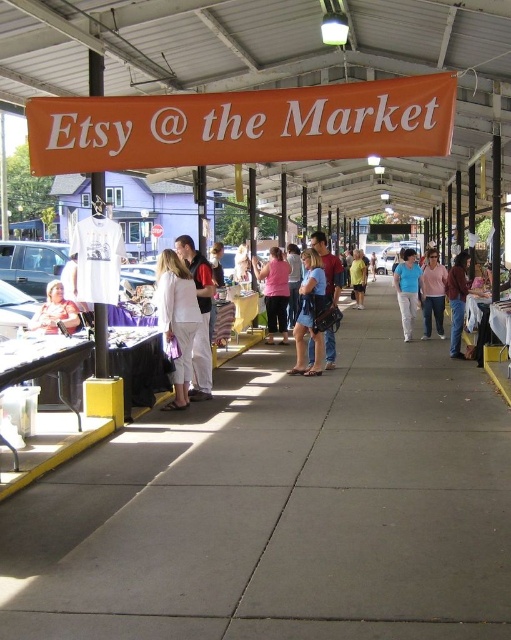
You are a customer at the Etsy market and want to buy both the blue denim jeans at center and the denim jacket at center. You notice they are displayed in a specific arrangement. Which item is placed higher up?

The blue denim jeans at center is located above the denim jacket at center, so the jeans are placed higher up.

You are a customer at the Etsy market and see two items displayed on a table at the center of the walkway. The items are the blue denim jeans at center and the denim jacket at center. Which item is located to the left when facing the table?

The blue denim jeans at center is positioned on the left side of the denim jacket at center, so when facing the table, the blue denim jeans at center is to the left of the denim jacket at center.

You are standing at the entrance of the market and see two points marked on the walkway. The first point is at coordinate point (474,509) and the second is at point (360,273). If you walk straight ahead, which point will you encounter first?

Point (474,509) is in front of point (360,273), so you will encounter point (474,509) first when walking straight ahead.